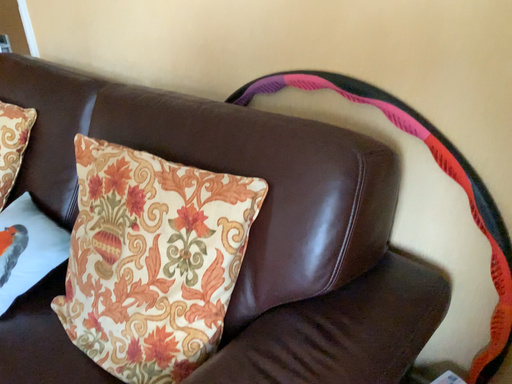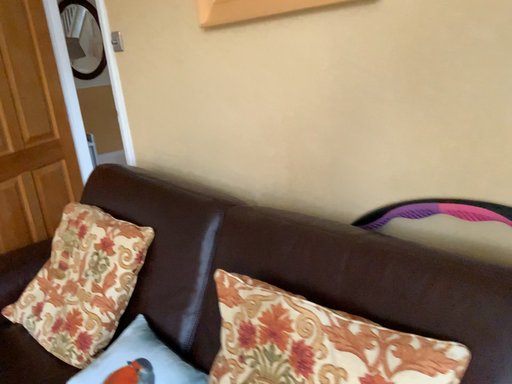
Question: Which way did the camera rotate in the video?

Choices:
 (A) rotated downward
 (B) rotated upward

Answer: (B)